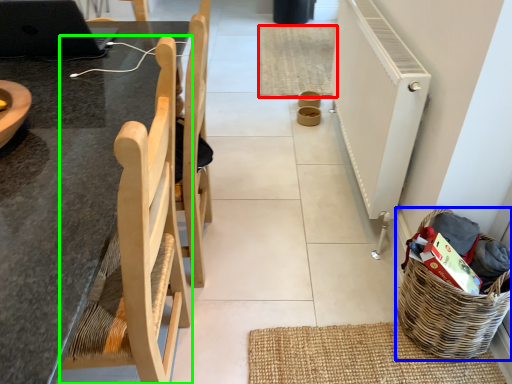
Question: Which is nearer to the mat (highlighted by a red box)? basket (highlighted by a blue box) or chair (highlighted by a green box).

Choices:
 (A) basket
 (B) chair

Answer: (A)